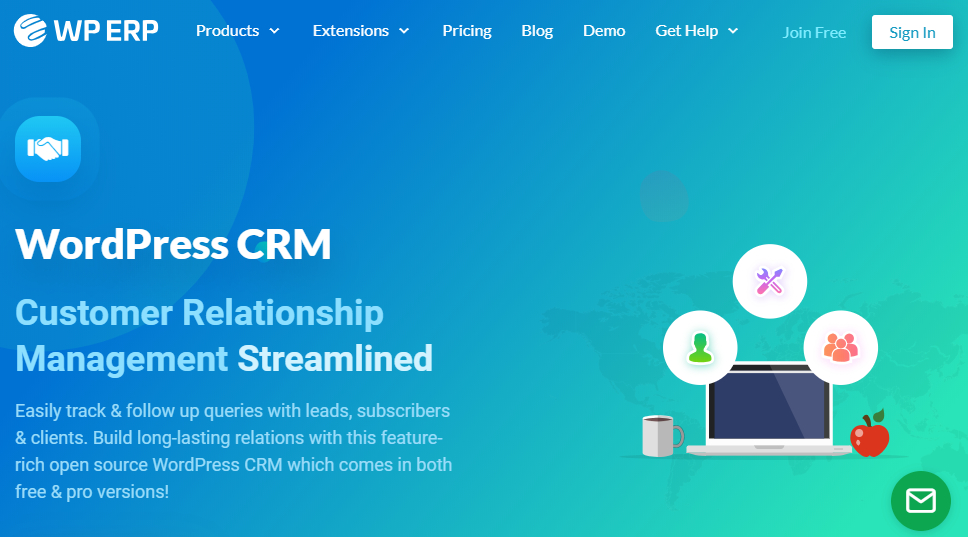
Find the location of a particular element. laptop is located at coordinates (802, 448).